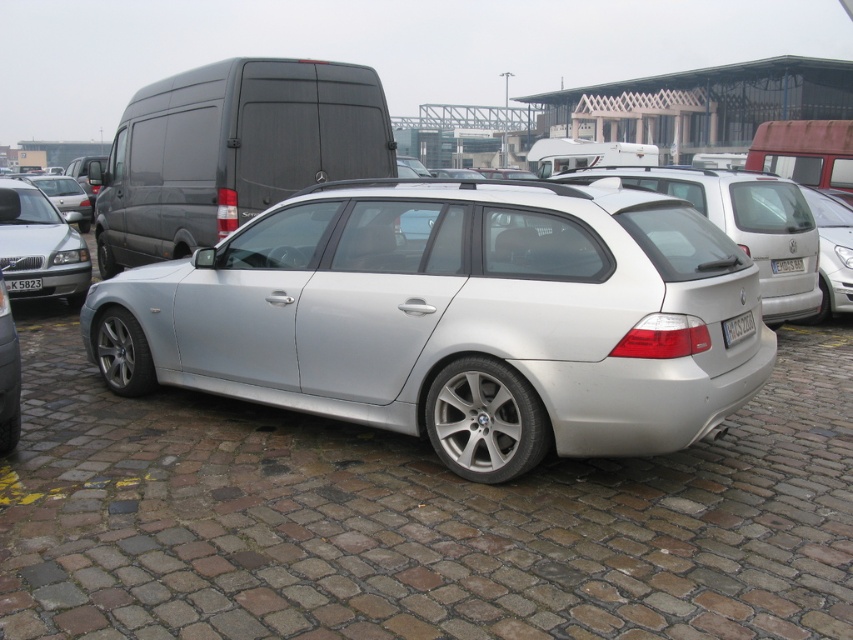
You are a parking attendant who needs to fit a compact car into a parking spot that can only accommodate vehicles up to the size of the black plastic license plate at center. Can the matte silver car at left fit in the spot?

The matte silver car at left is larger in size than the black plastic license plate at center, so it cannot fit into the parking spot designed for vehicles up to the size of the black plastic license plate at center.

You are a parking attendant who needs to direct a driver to park their car in a spot that requires backing into the space. The driver is currently facing forward and sees the matte silver car at left and the white plastic license plate at center. Which object should they use as a reference to align their car correctly while reversing?

The driver should use the white plastic license plate at center as a reference because the matte silver car at left is positioned to its left side, meaning the license plate is closer to the center of the parking space. Aligning with the license plate ensures proper centering during reverse parking.

You are a delivery person who needs to park your van next to the matte silver car at left and the white plastic license plate at center. Considering their heights, which vehicle should you avoid parking too close to to prevent scraping your van?

The matte silver car at left is much taller than the white plastic license plate at center, so you should avoid parking too close to the matte silver car at left to prevent scraping your van.